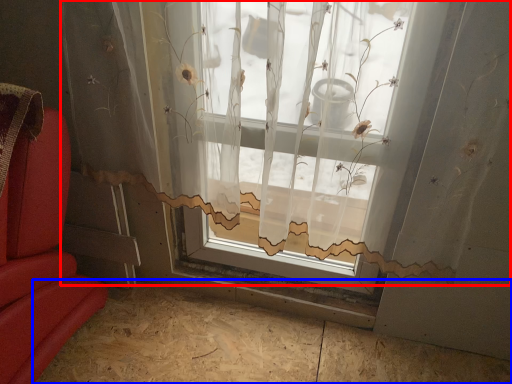
Question: Which object is further to the camera taking this photo, window (highlighted by a red box) or plywood (highlighted by a blue box)?

Choices:
 (A) window
 (B) plywood

Answer: (B)